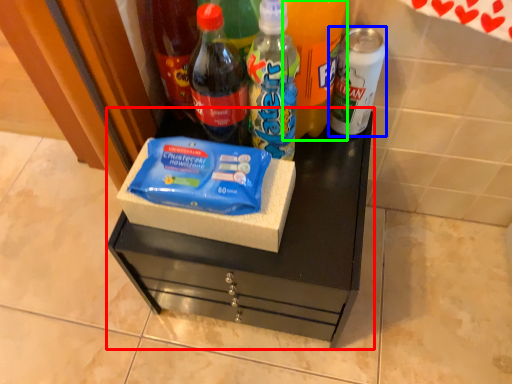
Question: Which is nearer to the vanity (highlighted by a red box)? bottle (highlighted by a blue box) or bottle (highlighted by a green box).

Choices:
 (A) bottle
 (B) bottle

Answer: (B)